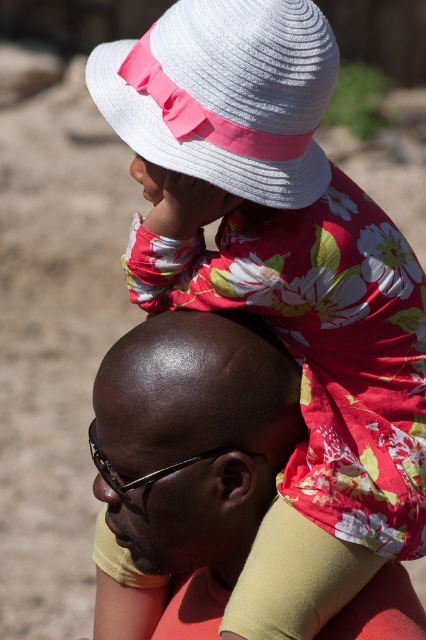
Question: Which of the following is the closest to the observer?

Choices:
 (A) shiny bald head at center
 (B) white woven hat at upper center

Answer: (B)

Question: Can you confirm if shiny bald head at center is bigger than white woven hat at upper center?

Choices:
 (A) no
 (B) yes

Answer: (B)

Question: Can you confirm if shiny bald head at center is positioned to the right of white woven hat at upper center?

Choices:
 (A) no
 (B) yes

Answer: (A)

Question: Which point is closer to the camera?

Choices:
 (A) shiny bald head at center
 (B) white woven hat at upper center

Answer: (B)

Question: Considering the relative positions of shiny bald head at center and white woven hat at upper center in the image provided, where is shiny bald head at center located with respect to white woven hat at upper center?

Choices:
 (A) left
 (B) right

Answer: (A)